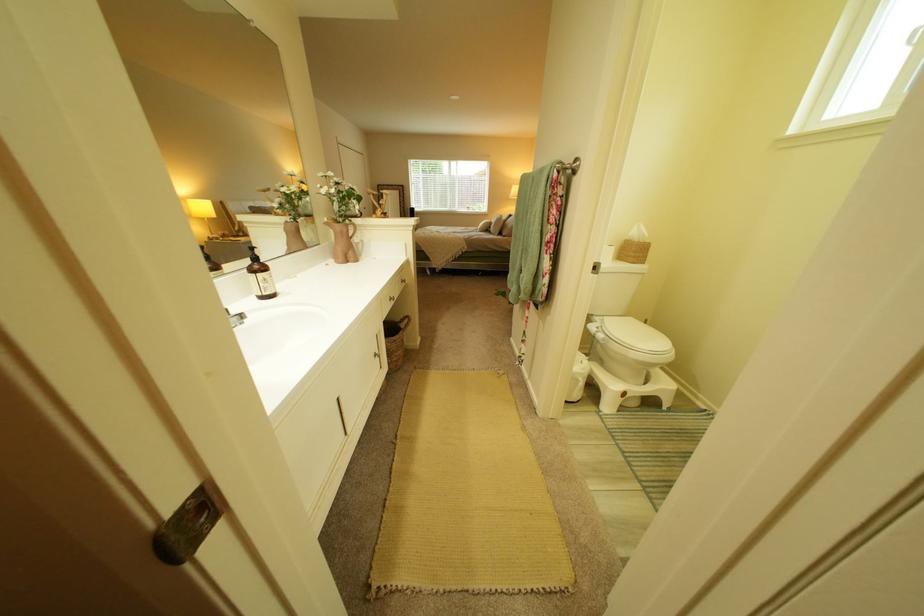
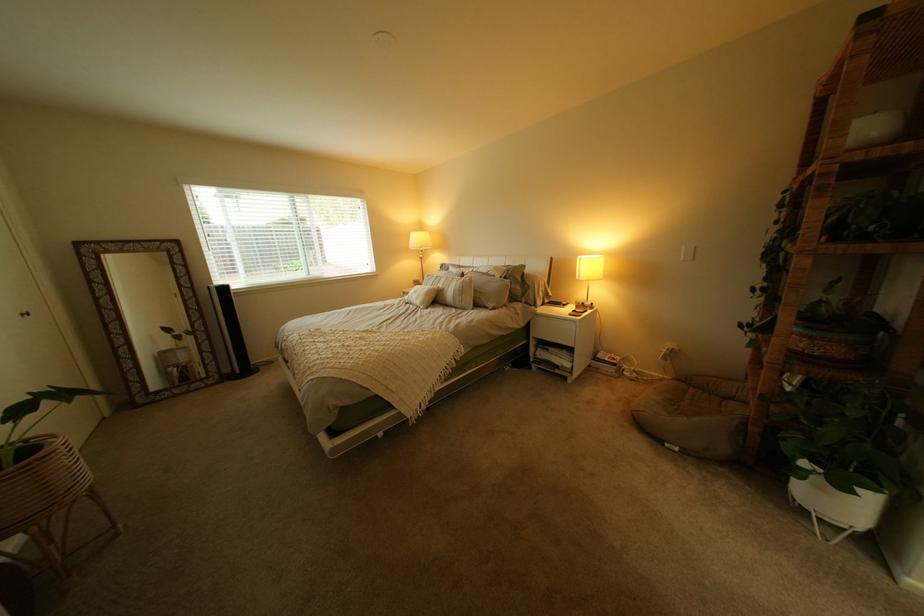
The point at (381, 209) is marked in the first image. Where is the corresponding point in the second image?

(42, 315)